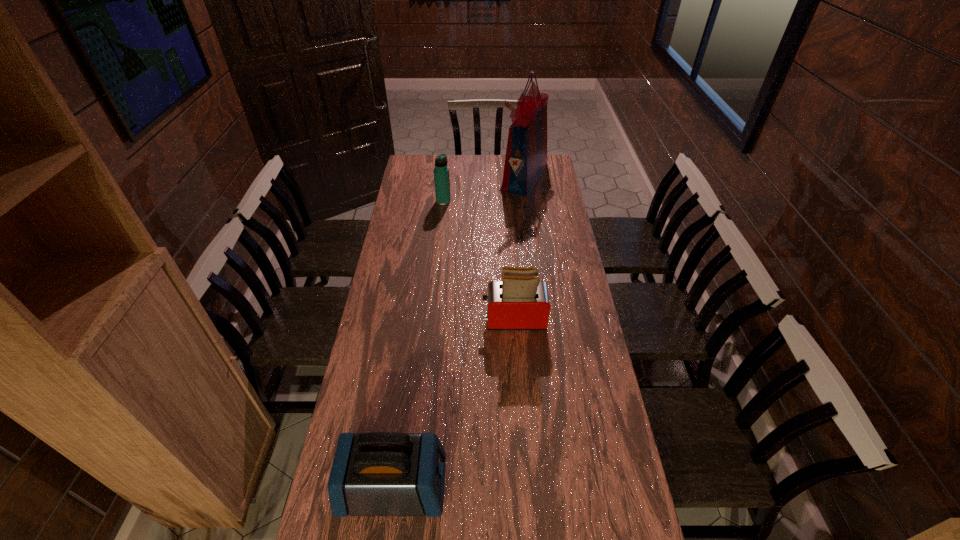
At what (x,y) coordinates should I click in order to perform the action: click on free space at the far edge. Please return your answer as a coordinate pair (x, y). This screenshot has height=540, width=960. Looking at the image, I should click on (467, 166).

Locate an element on the screen. This screenshot has height=540, width=960. vacant position at the left edge of the desktop is located at coordinates (419, 238).

The image size is (960, 540). In the image, there is a desktop. Identify the location of free space at the right edge. (554, 260).

This screenshot has height=540, width=960. I want to click on vacant space that's between the third farthest object and the grocery bag, so click(x=519, y=248).

At what (x,y) coordinates should I click in order to perform the action: click on free area in between the thermos bottle and the grocery bag. Please return your answer as a coordinate pair (x, y). This screenshot has width=960, height=540. Looking at the image, I should click on (484, 188).

Locate an element on the screen. free spot between the thermos bottle and the grocery bag is located at coordinates (484, 188).

Image resolution: width=960 pixels, height=540 pixels. Identify the location of vacant region between the farther toaster and the second farthest object. 479,260.

Where is `blank region between the farther toaster and the left toaster`? blank region between the farther toaster and the left toaster is located at coordinates (454, 403).

At what (x,y) coordinates should I click in order to perform the action: click on blank region between the grocery bag and the right toaster. Please return your answer as a coordinate pair (x, y). Looking at the image, I should click on (519, 248).

Image resolution: width=960 pixels, height=540 pixels. What are the coordinates of `vacant area that lies between the third farthest object and the thermos bottle` in the screenshot? It's located at (479, 260).